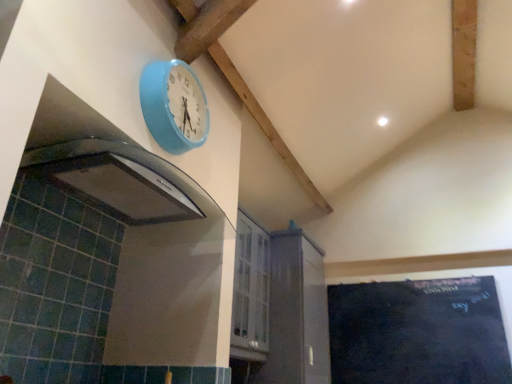
Question: Would you say white glossy cabinet at center is to the left or to the right of black chalkboard at lower right in the picture?

Choices:
 (A) right
 (B) left

Answer: (B)

Question: Looking at the image, does white glossy cabinet at center seem bigger or smaller compared to black chalkboard at lower right?

Choices:
 (A) small
 (B) big

Answer: (B)

Question: Based on their relative distances, which object is farther from the light blue plastic clock at upper center?

Choices:
 (A) black chalkboard at lower right
 (B) white glossy cabinet at center

Answer: (A)

Question: Which of these objects is positioned closest to the light blue plastic clock at upper center?

Choices:
 (A) white glossy cabinet at center
 (B) black chalkboard at lower right

Answer: (A)